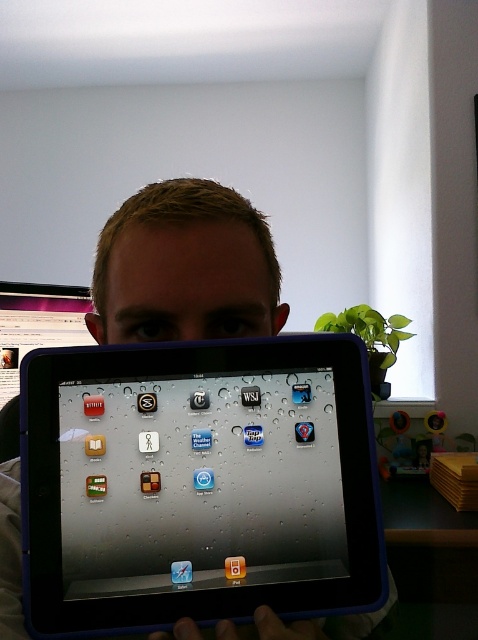
You are a delivery person who needs to place a satin black tablet at center and a matte skin at center into a box. The box has a height limit of 10 cm. Can both items fit vertically in the box?

The satin black tablet at center is taller than the matte skin at center. However, the exact height of the satin black tablet at center isn t specified, so we can t determine if it will fit within the 10 cm height limit. Both items might or might not fit depending on their actual dimensions.

You are a delivery person who needs to place both the satin black tablet at center and the matte skin at center into a delivery box. The box can only accommodate one item due to size restrictions. Which item should you choose to fit in the box?

The satin black tablet at center has a larger size compared to matte skin at center, so you should choose the matte skin at center to fit in the box since it is smaller.

You are a photographer trying to capture a clear shot of the matte skin at center without the satin black tablet at center blocking it. Based on their positions, can you adjust your angle to achieve this?

The satin black tablet at center is located below the matte skin at center, so you can tilt your camera upwards to capture the matte skin at center without the tablet obstructing the view.